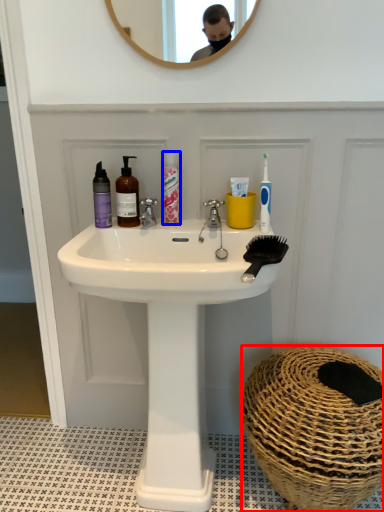
Question: Which object is further to the camera taking this photo, basket (highlighted by a red box) or mouthwash (highlighted by a blue box)?

Choices:
 (A) basket
 (B) mouthwash

Answer: (B)